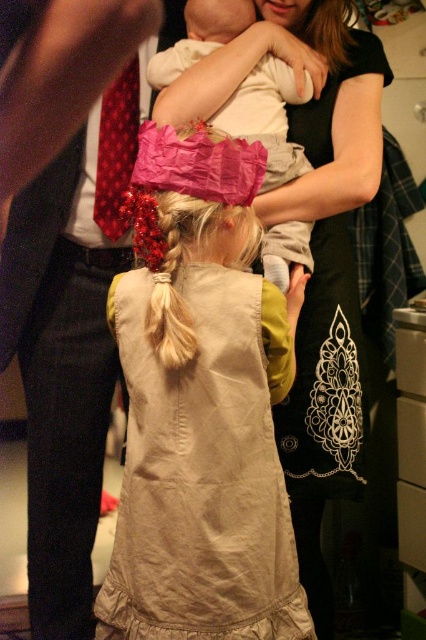
Question: Is light beige fabric dress at center to the left of soft white fabric baby at center from the viewer's perspective?

Choices:
 (A) yes
 (B) no

Answer: (A)

Question: Which object appears farthest from the camera in this image?

Choices:
 (A) soft white fabric baby at center
 (B) black cotton dress at center

Answer: (B)

Question: Which is farther from the black cotton dress at center?

Choices:
 (A) soft white fabric baby at center
 (B) light beige fabric dress at center

Answer: (B)

Question: Which point appears farthest from the camera in this image?

Choices:
 (A) (195, 573)
 (B) (196, 38)
 (C) (290, 32)

Answer: (C)

Question: Can you confirm if light beige fabric dress at center is thinner than black cotton dress at center?

Choices:
 (A) no
 (B) yes

Answer: (B)

Question: Is light beige fabric dress at center positioned before soft white fabric baby at center?

Choices:
 (A) yes
 (B) no

Answer: (A)